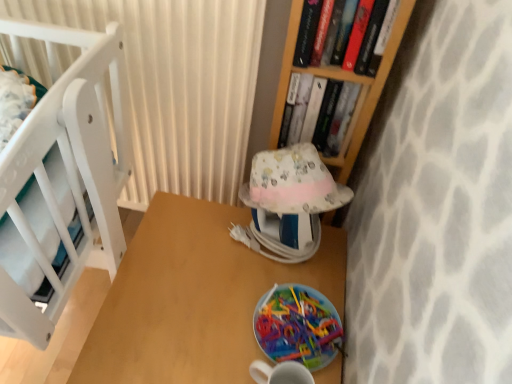
Locate an element on the screen. This screenshot has width=512, height=384. free point above translucent plastic plate at lower center (from a real-world perspective) is located at coordinates tap(302, 314).